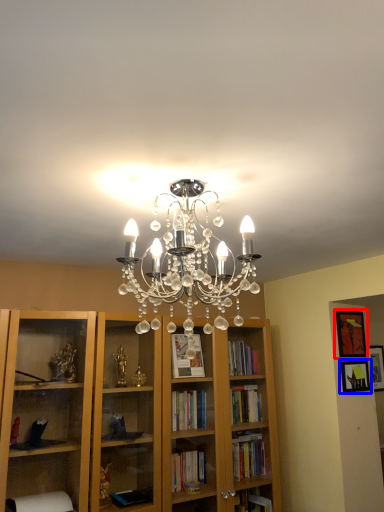
Question: Which point is further to the camera, picture frame (highlighted by a red box) or picture frame (highlighted by a blue box)?

Choices:
 (A) picture frame
 (B) picture frame

Answer: (A)